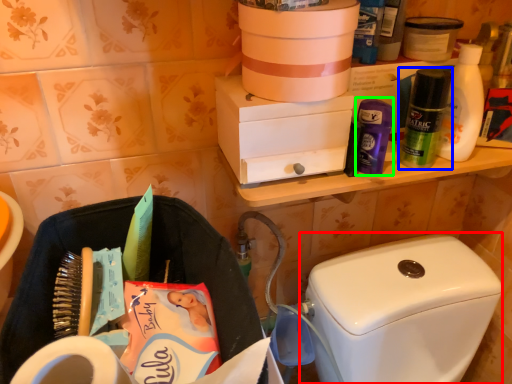
Question: Based on their relative distances, which object is farther from washer (highlighted by a red box)? Choose from toiletry (highlighted by a blue box) and toiletry (highlighted by a green box).

Choices:
 (A) toiletry
 (B) toiletry

Answer: (B)